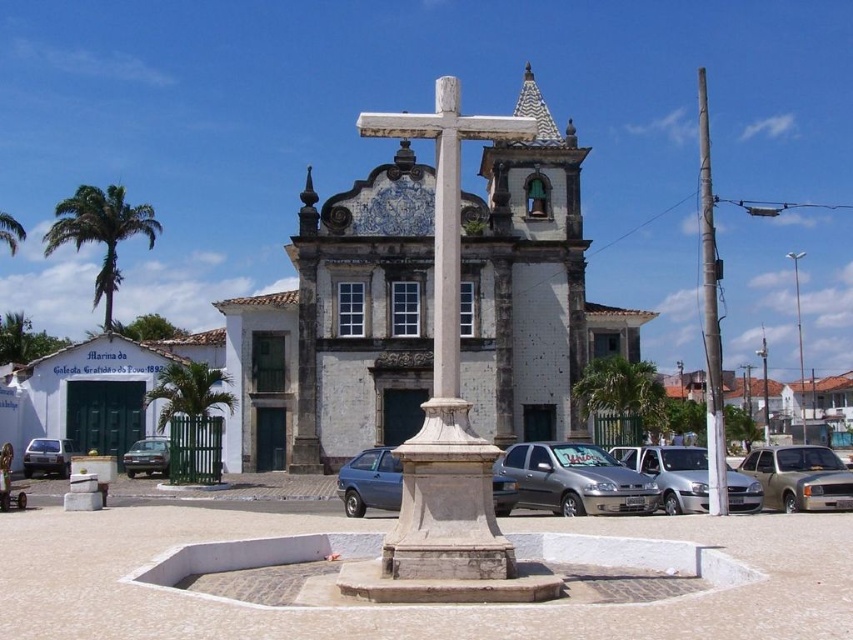
Question: Estimate the real-world distances between objects in this image. Which object is closer to the brown metallic car at lower left?

Choices:
 (A) gold metallic car at center
 (B) white stone church at center

Answer: (B)

Question: Which object appears closest to the camera in this image?

Choices:
 (A) white stone cross at center
 (B) white stone church at center
 (C) satin silver car at center
 (D) gold metallic car at center

Answer: (A)

Question: Does green leafy palm tree at center appear on the left side of brown metallic car at lower left?

Choices:
 (A) no
 (B) yes

Answer: (A)

Question: Is white stone church at center positioned at the back of silver metallic car at center?

Choices:
 (A) yes
 (B) no

Answer: (A)

Question: Does silver metallic van at center appear under silver metallic car at lower left?

Choices:
 (A) yes
 (B) no

Answer: (B)

Question: Which point is farther to the camera?

Choices:
 (A) (543, 474)
 (B) (102, 220)
 (C) (30, 440)
 (D) (514, 259)

Answer: (B)